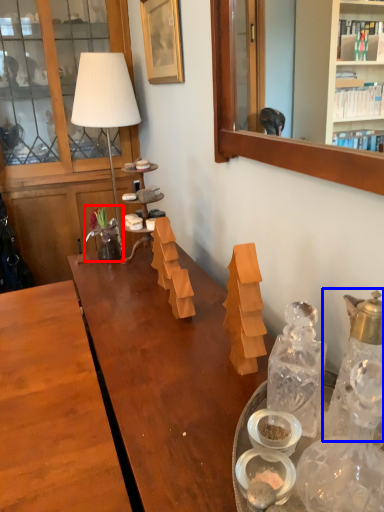
Question: Which of the following is the closest to the observer, flower (highlighted by a red box) or bottle (highlighted by a blue box)?

Choices:
 (A) flower
 (B) bottle

Answer: (B)